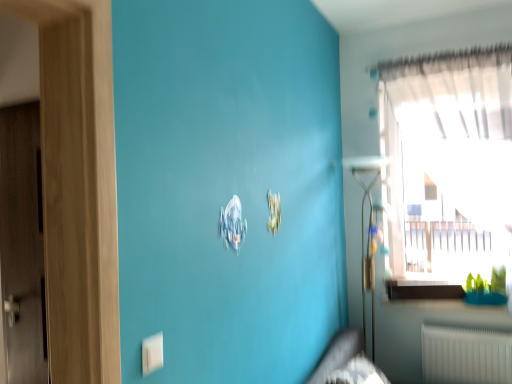
Question: Is white glossy window sill at lower right wider or thinner than white plastic electric outlet at lower left?

Choices:
 (A) thin
 (B) wide

Answer: (B)

Question: Is white glossy window sill at lower right to the left or to the right of white plastic electric outlet at lower left in the image?

Choices:
 (A) left
 (B) right

Answer: (B)

Question: Which object is positioned farthest from the white glossy window sill at lower right?

Choices:
 (A) white plastic electric outlet at lower left
 (B) dark gray fabric bed frame at lower center
 (C) transparent glass window at upper right

Answer: (A)

Question: Which object is positioned farthest from the white glossy window sill at lower right?

Choices:
 (A) transparent glass window at upper right
 (B) dark gray fabric bed frame at lower center
 (C) white plastic electric outlet at lower left

Answer: (C)